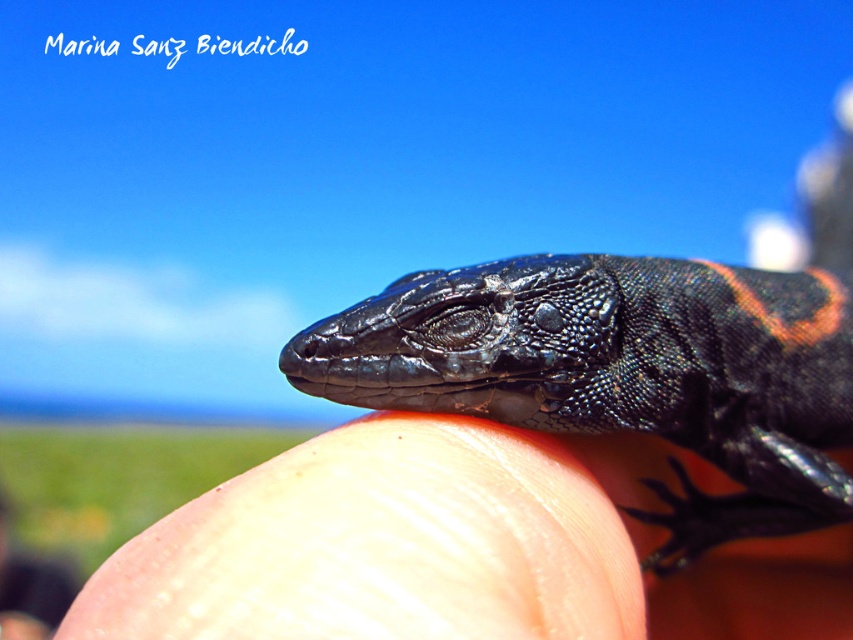
Who is taller, shiny black lizard at center or smooth skin at center?

shiny black lizard at center is taller.

Between shiny black lizard at center and smooth skin at center, which one appears on the right side from the viewer's perspective?

Positioned to the right is shiny black lizard at center.

The height and width of the screenshot is (640, 853). I want to click on shiny black lizard at center, so click(622, 372).